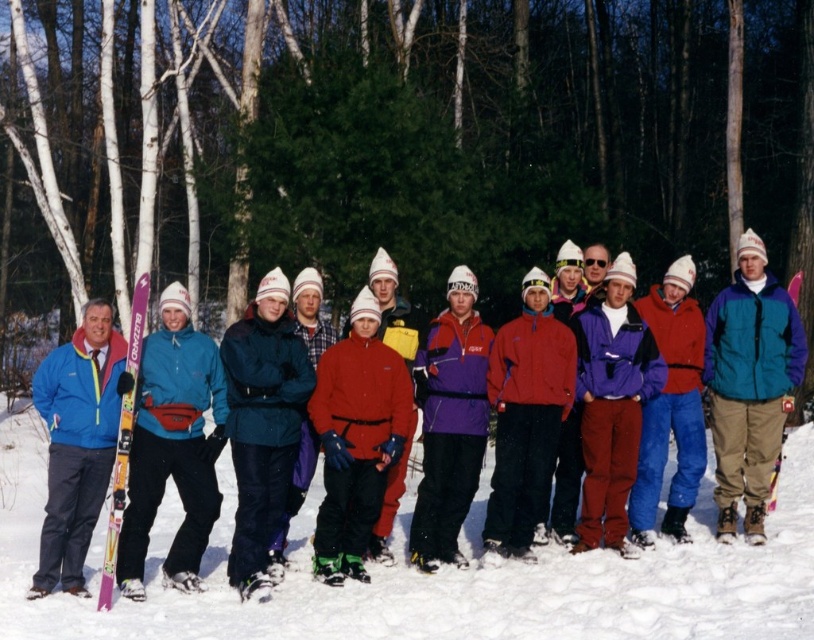
Question: Which is farther from the pink matte skis at left?

Choices:
 (A) white powder snow at center
 (B) pink plastic ski at center
 (C) blue fleece jacket at center

Answer: (B)

Question: Which of the following is the closest to the observer?

Choices:
 (A) pink matte skis at left
 (B) white powder snow at center
 (C) pink plastic ski at center
 (D) blue fleece jacket at center

Answer: (B)

Question: Is white powder snow at center below blue fleece jacket at center?

Choices:
 (A) yes
 (B) no

Answer: (A)

Question: Can you confirm if white powder snow at center is thinner than pink plastic ski at center?

Choices:
 (A) yes
 (B) no

Answer: (B)

Question: Which point is closer to the camera?

Choices:
 (A) (663, 564)
 (B) (133, 419)

Answer: (B)

Question: Is pink matte skis at left positioned behind pink plastic ski at center?

Choices:
 (A) no
 (B) yes

Answer: (A)